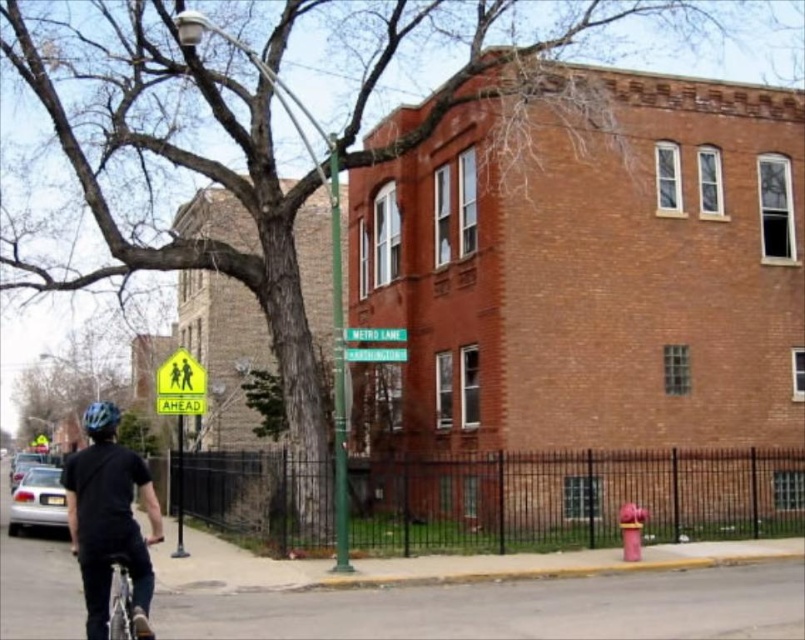
You are a delivery person needing to park your silver metallic bicycle at lower left near the green plastic street sign at center. Can you park the bicycle directly under the sign?

The silver metallic bicycle at lower left is located below green plastic street sign at center, so yes, you can park the bicycle directly under the sign.

You are a delivery person standing at the point marked by coordinates point [143,637], and you need to deliver a package to the address at point [374,353]. Based on the scene, which direction should you move to reach your destination?

Since point [143,637] is in front of point [374,353], you should move backward to reach point [374,353] from your current position.

You are a delivery person trying to navigate through the narrow alley between the matte pink fire hydrant at lower right and the green metallic street sign at upper center. Considering their sizes, which object might require more careful maneuvering around?

The green metallic street sign at upper center requires more careful maneuvering around because it occupies more space than the matte pink fire hydrant at lower right.